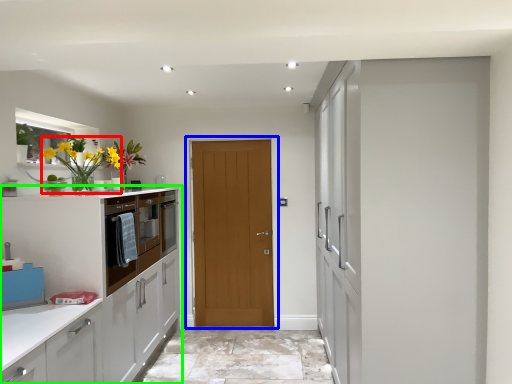
Question: Which is nearer to the floral arrangement (highlighted by a red box)? door (highlighted by a blue box) or cabinetry (highlighted by a green box).

Choices:
 (A) door
 (B) cabinetry

Answer: (B)